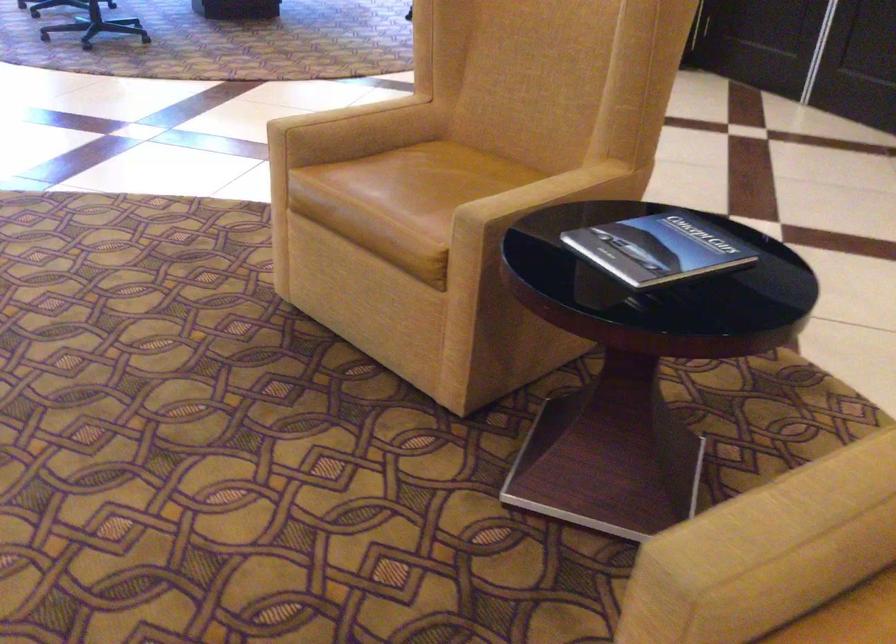
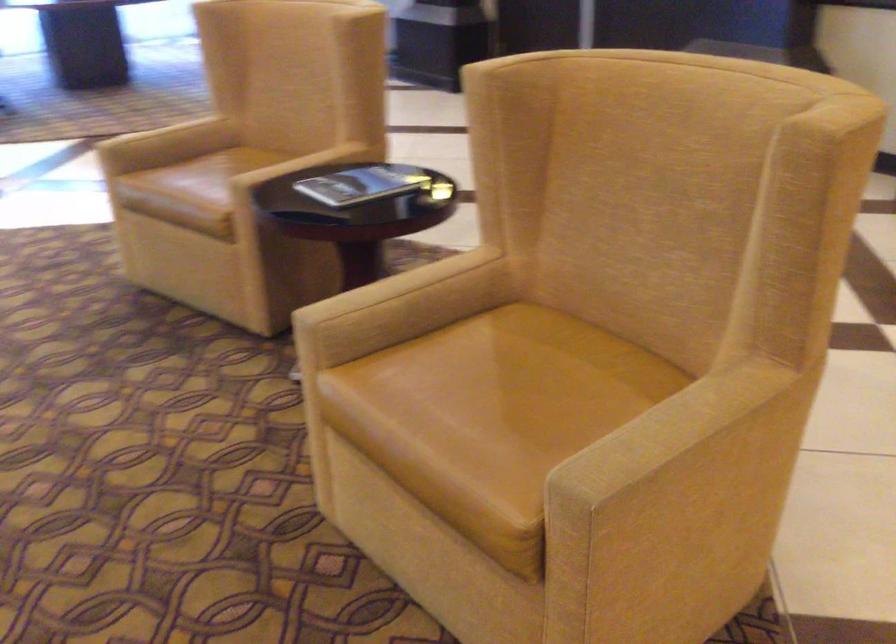
In the second image, find the point that corresponds to (x=375, y=118) in the first image.

(183, 129)